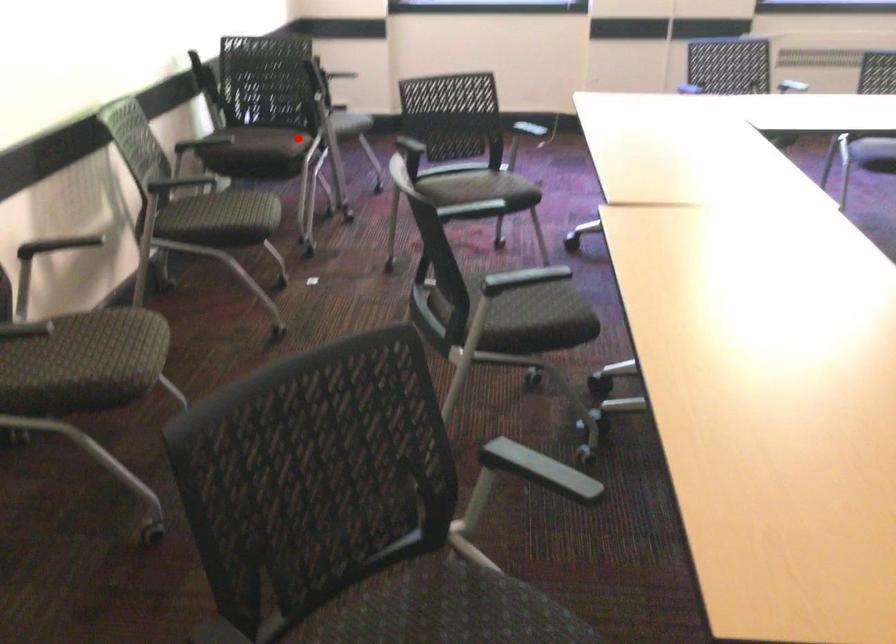
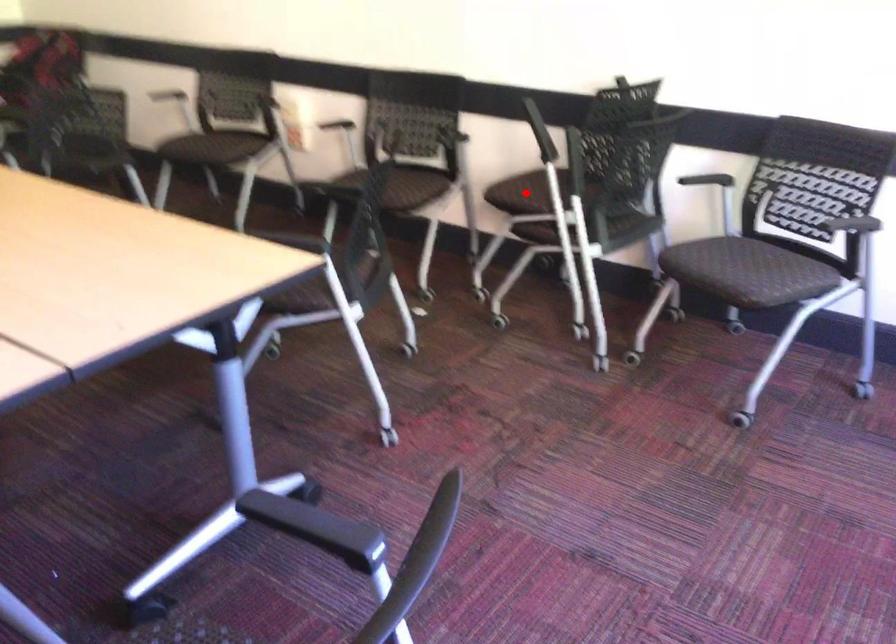
I am providing you with two images of the same scene from different viewpoints. A red point is marked on the first image and another point is marked on the second image. Is the marked point in image1 the same physical position as the marked point in image2?

Yes